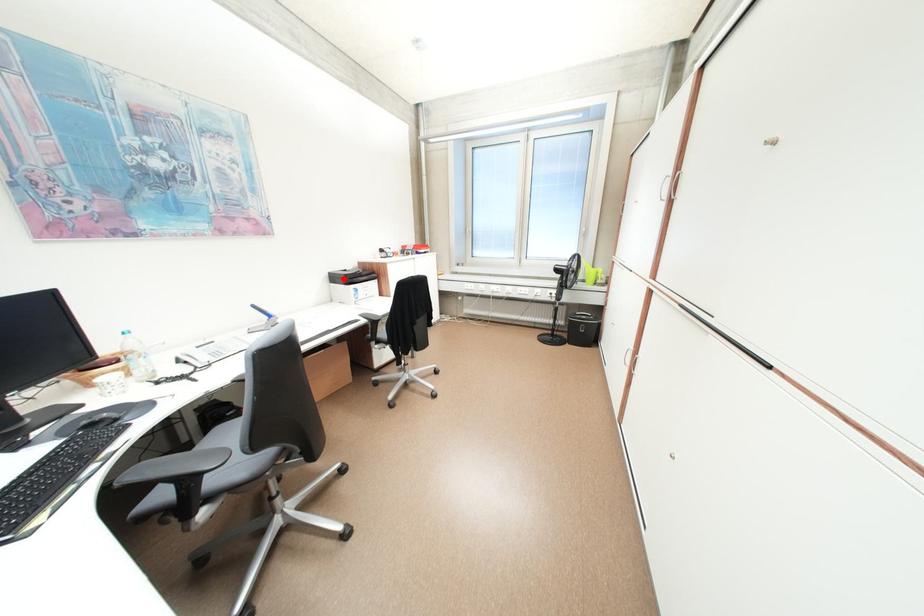
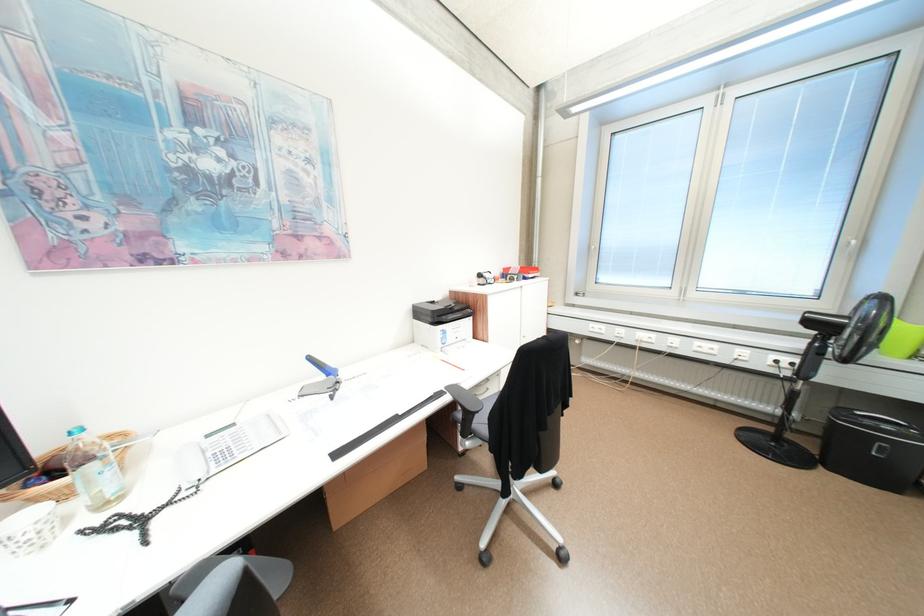
Question: I am providing you with two images of the same scene from different viewpoints. Image1 has a red point marked. In image2, the corresponding 3D location appears at what relative position? Reply with the corresponding letter.

Choices:
 (A) Closer
 (B) Farther

Answer: (B)